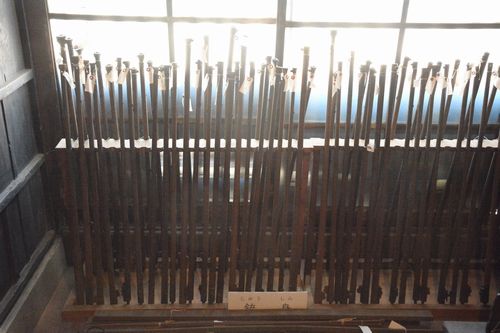
Identify the location of wall. The height and width of the screenshot is (333, 500). (34, 226), (12, 274).